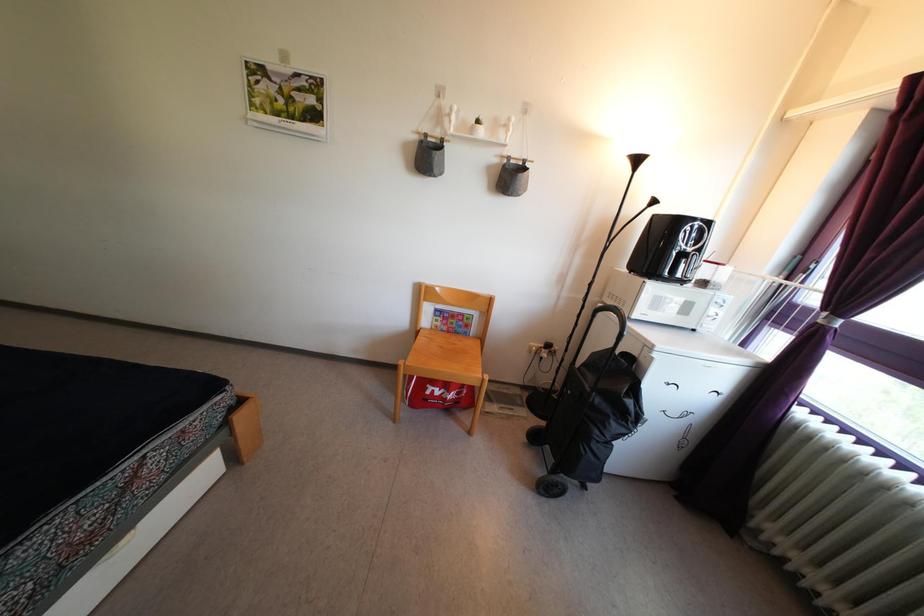
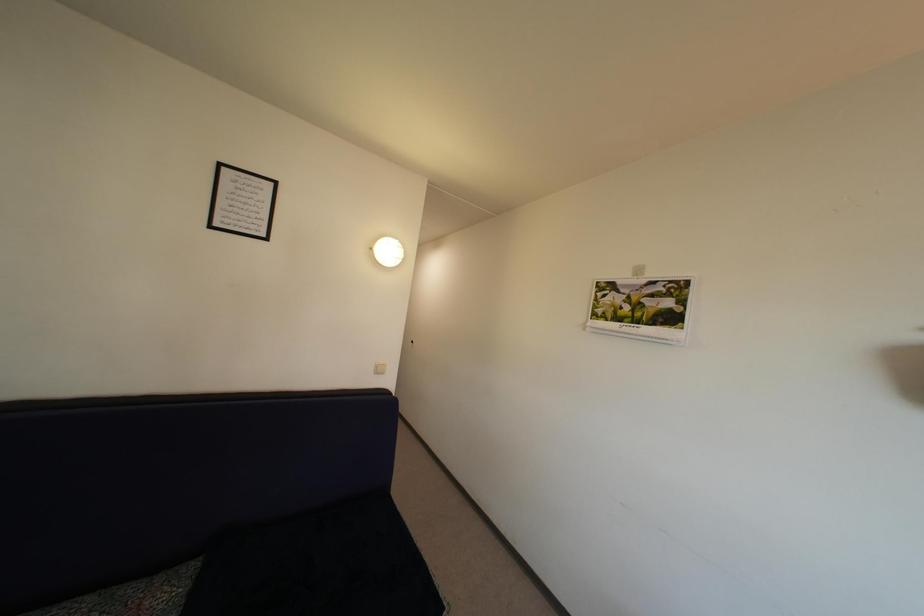
First-person continuous shooting, in which direction is the camera rotating?

The camera's rotation is toward left-up.